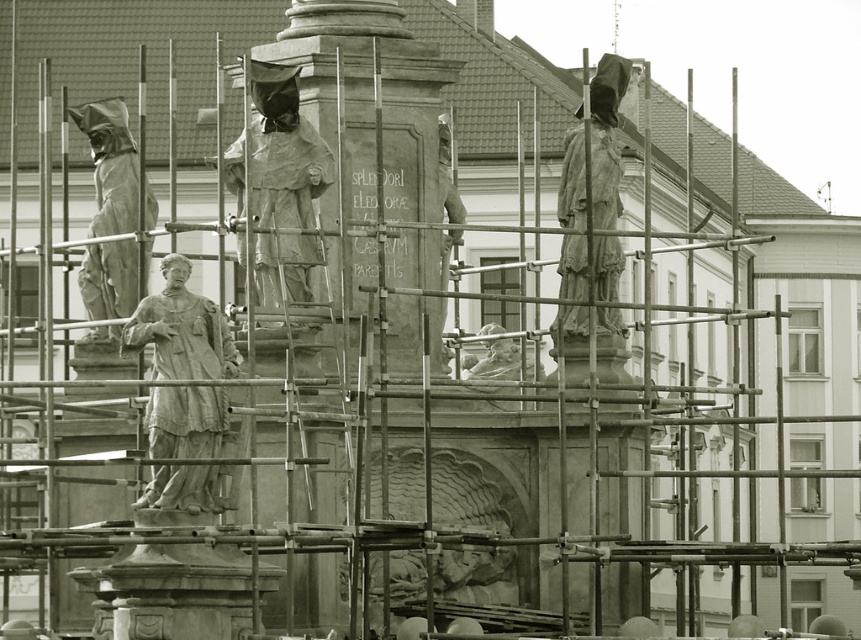
Is point (599, 276) behind point (146, 182)?

Yes, it is behind point (146, 182).

Locate an element on the screen. The height and width of the screenshot is (640, 861). matte stone statue at upper right is located at coordinates (606, 138).

Can you confirm if stone statue at center is positioned below matte stone statue at upper right?

Yes, stone statue at center is below matte stone statue at upper right.

Between stone statue at center and matte stone statue at upper right, which one appears on the right side from the viewer's perspective?

matte stone statue at upper right

Does point (209, 362) lie behind point (574, 312)?

No, it is in front of (574, 312).

The width and height of the screenshot is (861, 640). Identify the location of stone statue at center. (181, 330).

Does stone statue at center have a larger size compared to smooth stone statue at center?

No.

Can you confirm if stone statue at center is thinner than smooth stone statue at center?

No.

Does point (172, 493) come closer to viewer compared to point (258, 224)?

That is True.

Where is `stone statue at center`? stone statue at center is located at coordinates (181, 330).